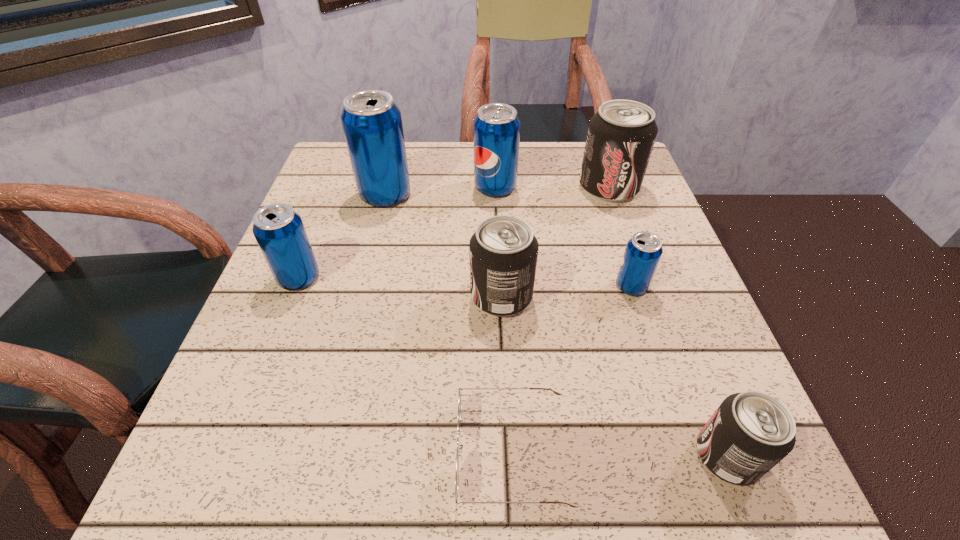
This screenshot has width=960, height=540. In order to click on free area in between the leftmost soda can and the farthest black soda can in this screenshot , I will do (x=454, y=233).

In order to click on free space between the rightmost blue pop soda and the smallest black soda can in this screenshot , I will do `click(679, 371)`.

Where is `unoccupied position between the rightmost blue pop soda and the leftmost black soda can`? unoccupied position between the rightmost blue pop soda and the leftmost black soda can is located at coordinates (566, 291).

Locate an element on the screen. The height and width of the screenshot is (540, 960). free spot between the leftmost soda can and the second biggest black soda can is located at coordinates (400, 287).

Where is `object that is the nearest to the smallest blue pop soda`? This screenshot has width=960, height=540. object that is the nearest to the smallest blue pop soda is located at coordinates (503, 251).

Find the location of a particular element. The width and height of the screenshot is (960, 540). the second closest object to the farthest black soda can is located at coordinates (643, 251).

Identify which soda can is the third closest to the leftmost black soda can. Please provide its 2D coordinates. Your answer should be formatted as a tuple, i.e. [(x, y)], where the tuple contains the x and y coordinates of a point satisfying the conditions above.

[(372, 123)]

The height and width of the screenshot is (540, 960). I want to click on the fifth closest soda can to the nearest soda can, so click(279, 231).

Locate which blue pop soda is the second closest to the third blue pop soda from left to right. Please provide its 2D coordinates. Your answer should be formatted as a tuple, i.e. [(x, y)], where the tuple contains the x and y coordinates of a point satisfying the conditions above.

[(643, 251)]

Locate which blue pop soda is the fourth closest to the farthest black soda can. Please provide its 2D coordinates. Your answer should be formatted as a tuple, i.e. [(x, y)], where the tuple contains the x and y coordinates of a point satisfying the conditions above.

[(279, 231)]